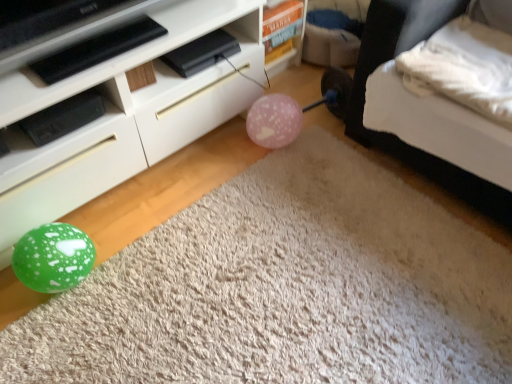
Question: From the image's perspective, is pink matte balloon at center located above or below white soft pillow at upper right?

Choices:
 (A) above
 (B) below

Answer: (B)

Question: Considering the positions of point (283, 109) and point (481, 52), is point (283, 109) closer or farther from the camera than point (481, 52)?

Choices:
 (A) farther
 (B) closer

Answer: (A)

Question: Estimate the real-world distances between objects in this image. Which object is closer to the green glossy balloon at lower left?

Choices:
 (A) pink matte balloon at center
 (B) white soft bed at lower right
 (C) white soft pillow at upper right
 (D) white glossy cabinet at lower left

Answer: (D)

Question: Estimate the real-world distances between objects in this image. Which object is closer to the green glossy balloon at lower left?

Choices:
 (A) white soft pillow at upper right
 (B) white glossy cabinet at lower left
 (C) white soft bed at lower right
 (D) pink matte balloon at center

Answer: (B)